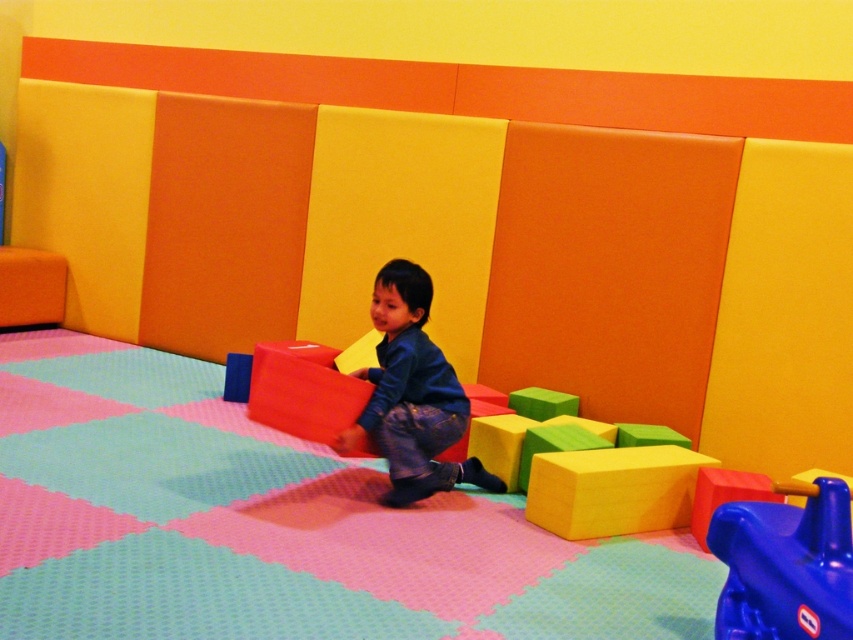
You are a parent trying to clean up the play area. You see the dark blue denim pants at center and the yellow foam cube at center. Which object should you pick up first to ensure you can reach both without moving more than 2 feet from your current position?

Both the dark blue denim pants at center and the yellow foam cube at center are 25.82 inches apart from each other. Since 25.82 inches is approximately 2.15 feet, which exceeds the 2 feet limit, you cannot reach both without moving. Therefore, you need to decide based on priority which one to pick up first.

You are a parent supervising a child in the play area. You see the blue plastic toy at lower right and the yellow foam cube at center. Which toy is positioned to the right of the other?

The blue plastic toy at lower right is to the right of the yellow foam cube at center.